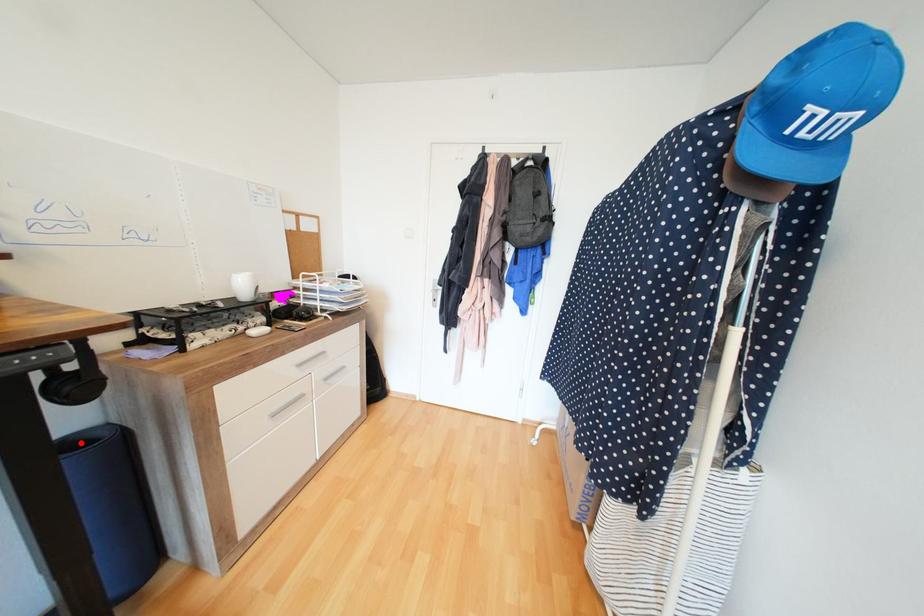
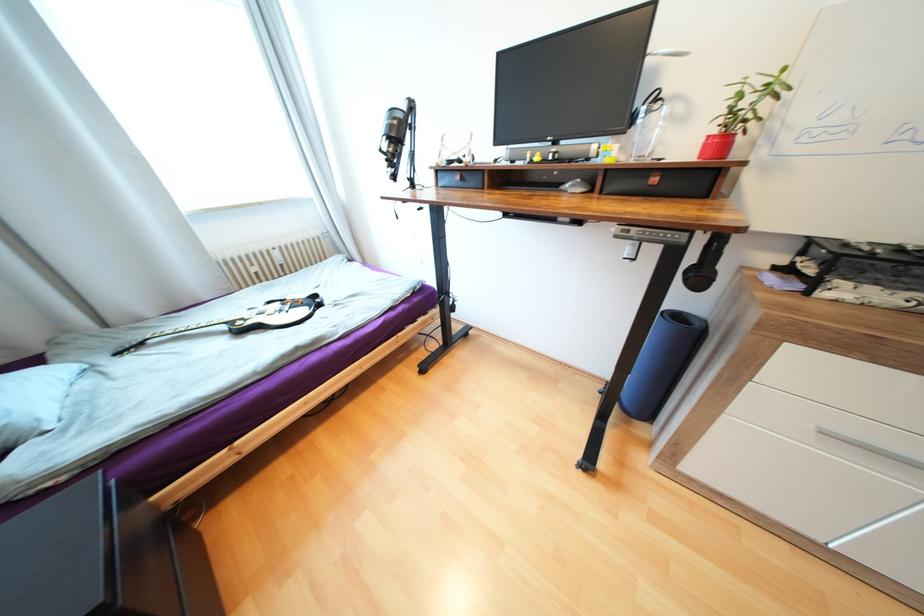
In the second image, find the point that corresponds to the highlighted location in the first image.

(685, 315)